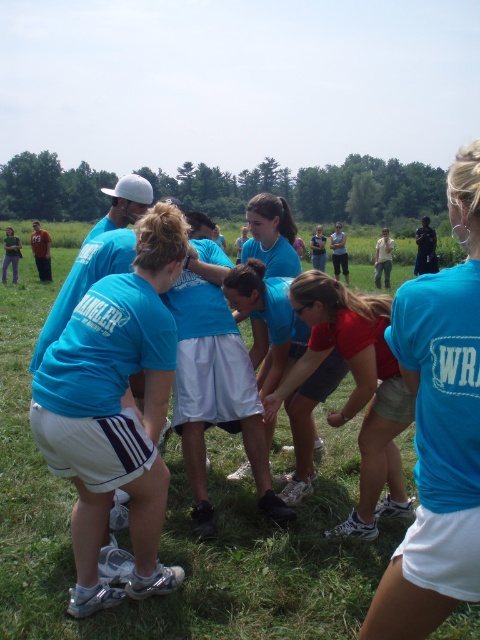
Question: Which point is farther to the camera?

Choices:
 (A) matte blue shirt at center
 (B) red matte shirt at center
 (C) green grass at center

Answer: (B)

Question: Can you confirm if green grass at center is positioned above red matte shirt at center?

Choices:
 (A) yes
 (B) no

Answer: (A)

Question: Which of the following is the closest to the observer?

Choices:
 (A) (389, 312)
 (B) (172, 465)

Answer: (A)

Question: Is matte blue shirt at center wider than red matte shirt at center?

Choices:
 (A) no
 (B) yes

Answer: (A)

Question: Among these objects, which one is nearest to the camera?

Choices:
 (A) green grass at center
 (B) matte blue shirt at center

Answer: (B)

Question: Does green grass at center appear over matte blue shirt at center?

Choices:
 (A) yes
 (B) no

Answer: (A)